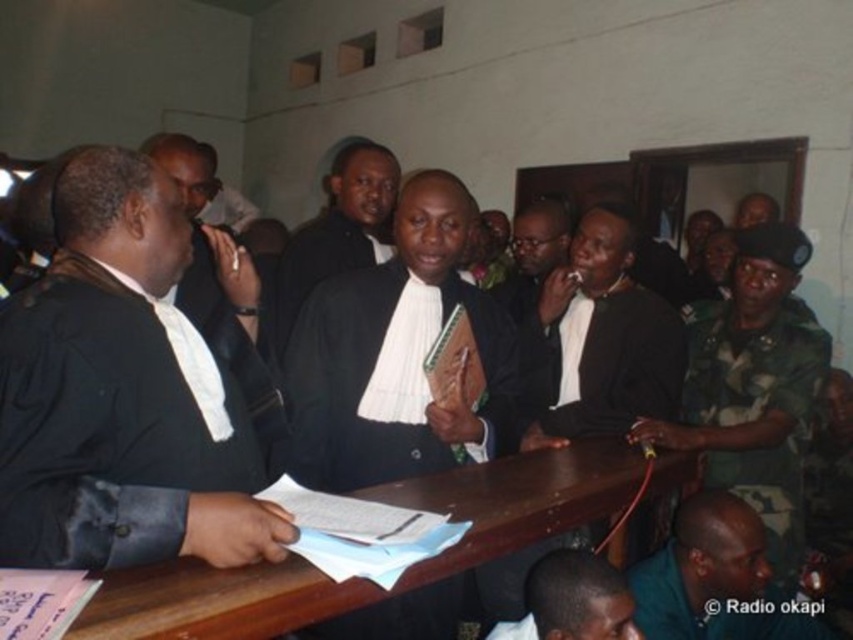
Can you confirm if white textured robe at center is smaller than dark skin bald head at lower center?

No.

Who is more distant from viewer, (x=286, y=264) or (x=508, y=632)?

The point (x=286, y=264) is more distant.

The height and width of the screenshot is (640, 853). Find the location of `white textured robe at center`. white textured robe at center is located at coordinates (338, 230).

The width and height of the screenshot is (853, 640). Find the location of `white textured robe at center`. white textured robe at center is located at coordinates (338, 230).

Is camo uniform at right positioned at the back of black matte suit at center?

No, it is not.

Is camo uniform at right in front of black matte suit at center?

That is True.

Between point (780, 228) and point (612, 339), which one is positioned behind?

The point (612, 339) is more distant.

At what (x,y) coordinates should I click in order to perform the action: click on camo uniform at right. Please return your answer as a coordinate pair (x, y). Looking at the image, I should click on (753, 388).

Is black satin robe at left behind camo uniform at right?

No, it is in front of camo uniform at right.

Find the location of a particular element. This screenshot has width=853, height=640. black satin robe at left is located at coordinates (122, 394).